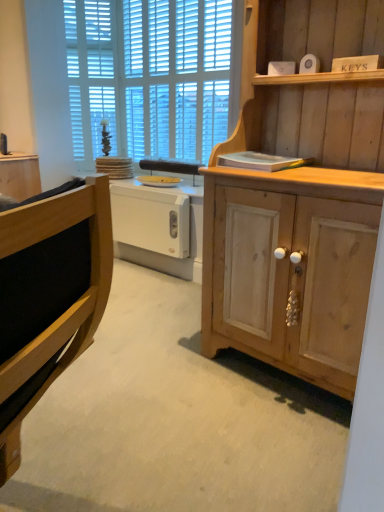
Identify the location of blank space to the left of natural wood cabinet at right, the 1th cabinetry when ordered from front to back. 154,374.